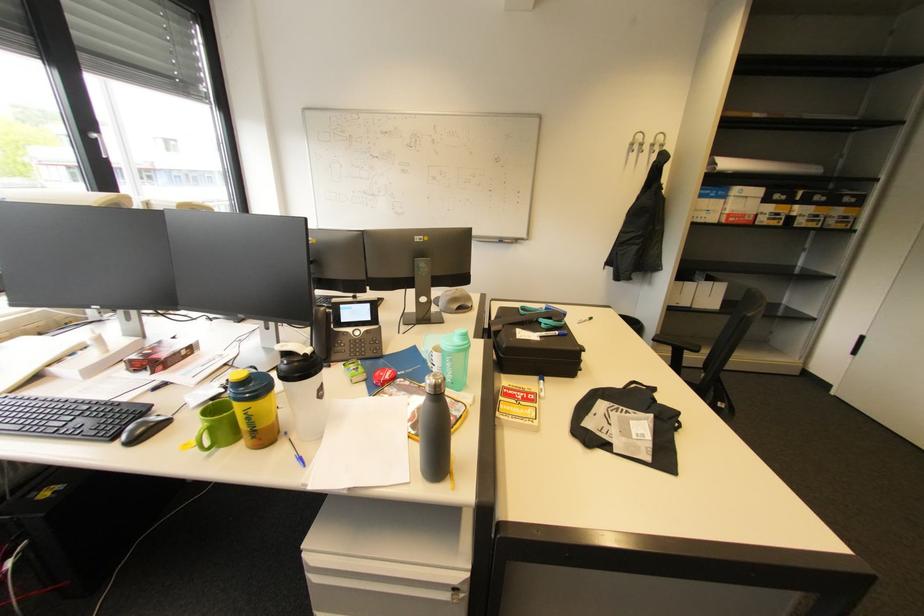
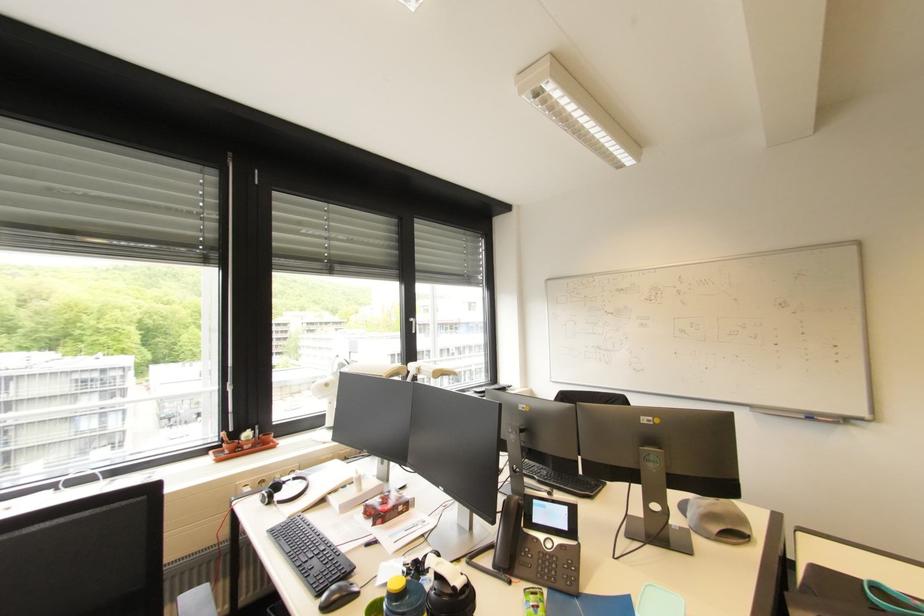
Based on the continuous images, in which direction is the camera rotating?

The camera rotated toward left-up.